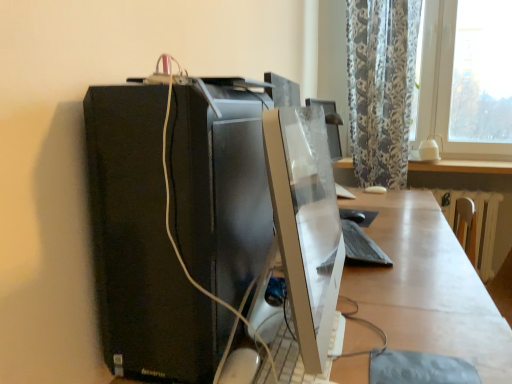
You are a GUI agent. You are given a task and a screenshot of the screen. Output one action in this format:
    pyautogui.click(x=<x>, y=<y>)
    Task: Click on the spots to the right of satin white monitor at center
    
    Given the screenshot: What is the action you would take?
    pyautogui.click(x=415, y=312)